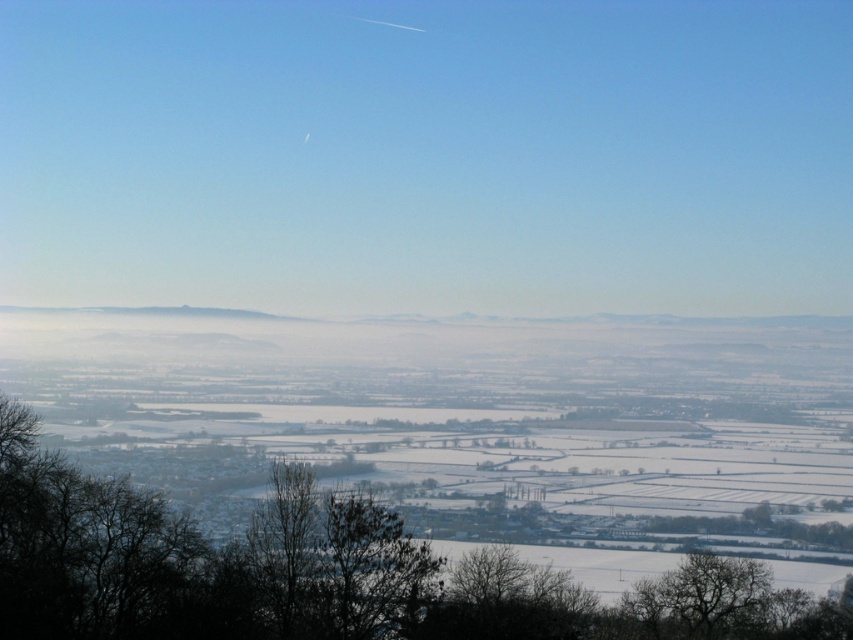
You are an artist sketching this winter scene. You want to emphasize the contrast between the silhouette bare tree at lower center and the bare branches at lower right. Which object should you draw first to establish the main structure of the composition?

The silhouette bare tree at lower center should be drawn first because it is larger in size compared to the bare branches at lower right, making it the dominant element in the composition.

You are an observer standing at the top of a hill overlooking the winter landscape. You notice the silhouette bare tree at lower center and the bare branches at lower right. Which object is positioned higher in the image?

The silhouette bare tree at lower center is positioned higher than the bare branches at lower right in the image.

You are an artist trying to sketch this winter scene. You want to ensure the silhouette bare tree at lower center and the bare branches at lower right are proportionally accurate. Which object should you draw wider?

The silhouette bare tree at lower center should be drawn wider because its width is larger than the bare branches at lower right.